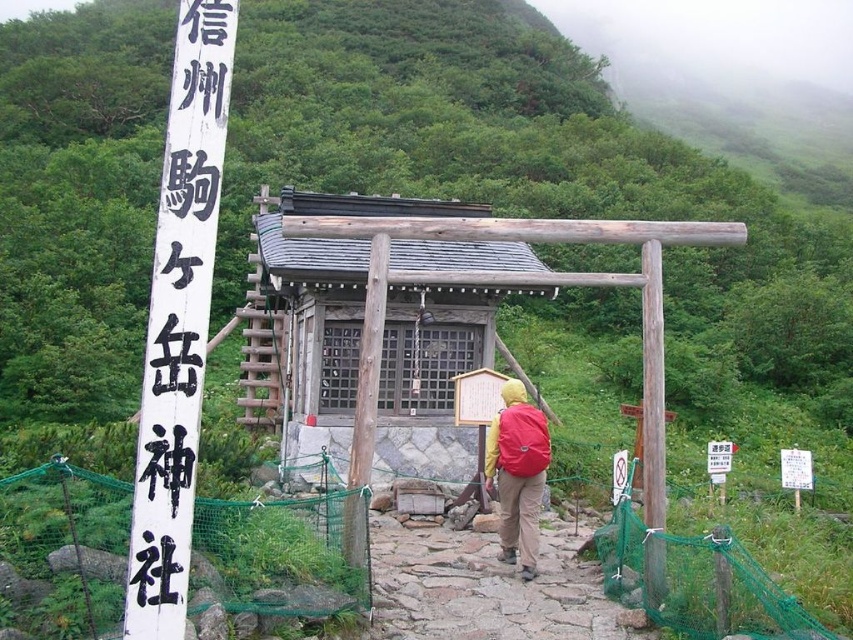
Question: Does red matte backpack at center have a larger size compared to brown wooden pole at center?

Choices:
 (A) no
 (B) yes

Answer: (A)

Question: Can you confirm if wooden shrine at center is positioned to the left of brown wooden pole at center?

Choices:
 (A) no
 (B) yes

Answer: (B)

Question: Can you confirm if black wood sign at left is positioned to the left of red matte backpack at center?

Choices:
 (A) no
 (B) yes

Answer: (B)

Question: Which point is farther to the camera?

Choices:
 (A) (440, 301)
 (B) (192, 113)
 (C) (387, 534)
 (D) (526, 456)

Answer: (A)

Question: Which point appears closest to the camera in this image?

Choices:
 (A) (724, 241)
 (B) (178, 474)

Answer: (B)

Question: Which of the following is the farthest from the observer?

Choices:
 (A) red matte backpack at center
 (B) black wood sign at left

Answer: (A)